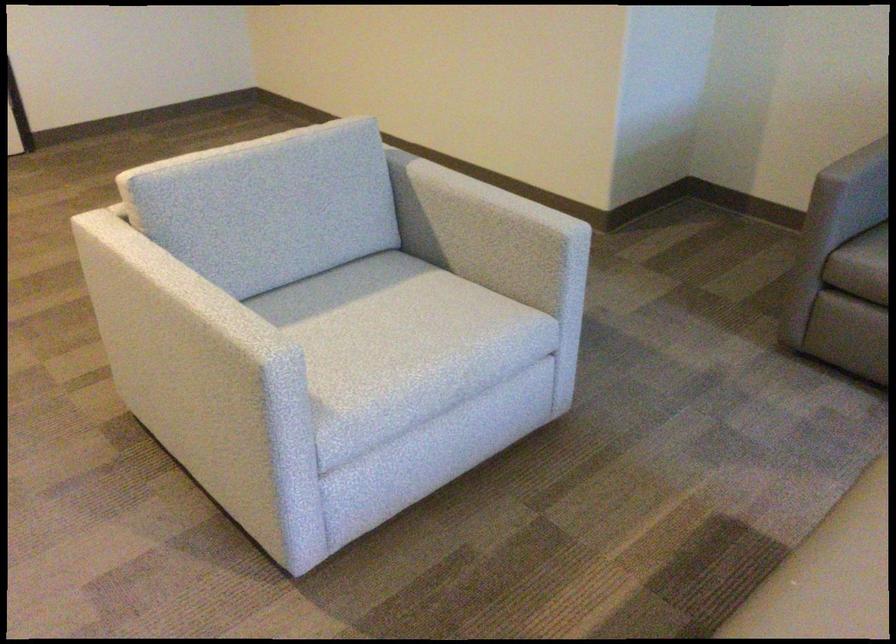
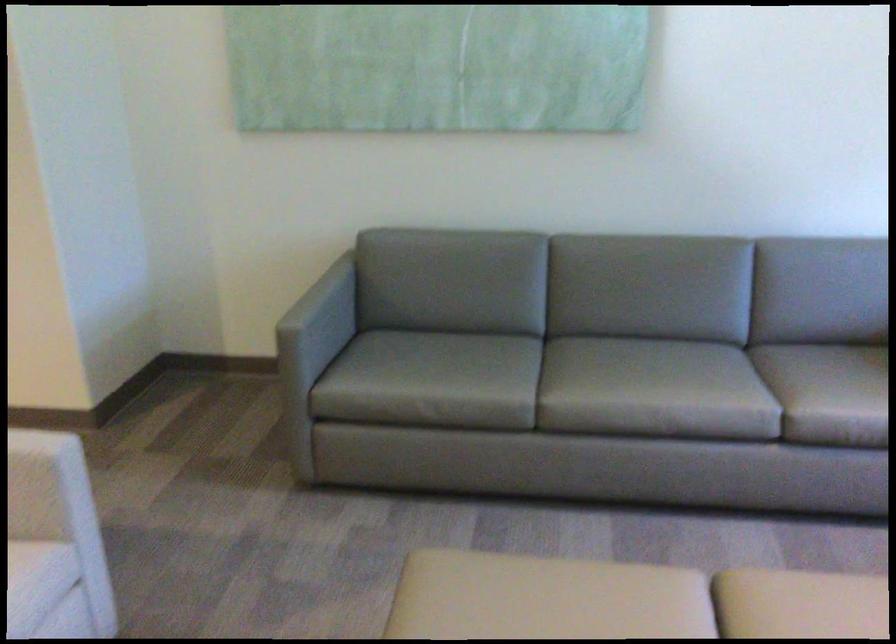
Question: Based on the continuous images, in which direction is the camera rotating? Reply with the corresponding letter.

Choices:
 (A) Left
 (B) Right
 (C) Up
 (D) Down

Answer: (B)